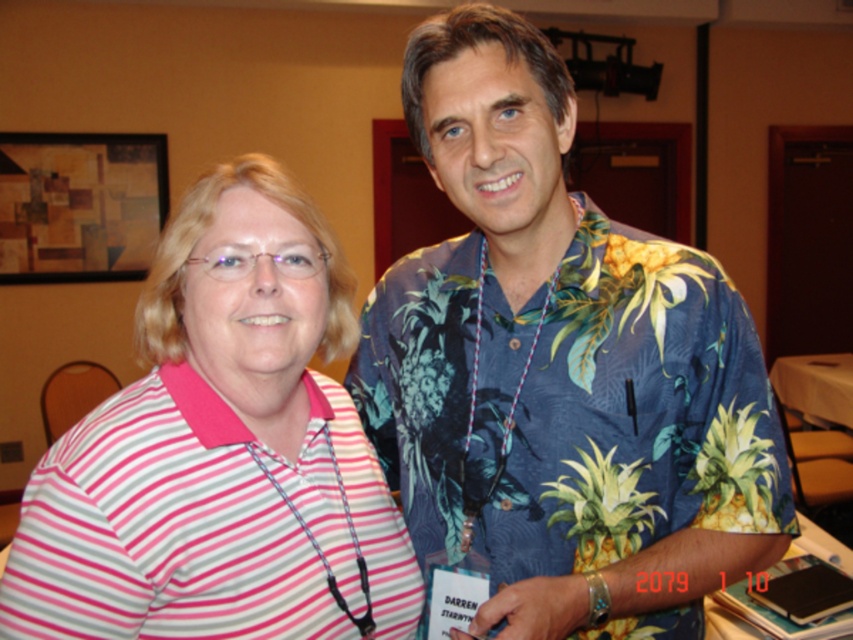
Question: Does blue floral shirt at center appear on the left side of pink striped shirt at left?

Choices:
 (A) no
 (B) yes

Answer: (A)

Question: Does blue floral shirt at center come behind pink striped shirt at left?

Choices:
 (A) yes
 (B) no

Answer: (A)

Question: Does blue floral shirt at center have a greater width compared to pink striped shirt at left?

Choices:
 (A) no
 (B) yes

Answer: (B)